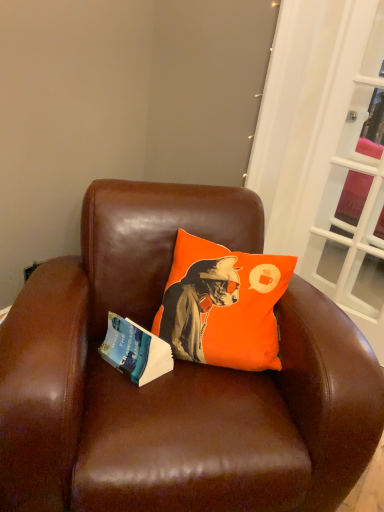
This screenshot has height=512, width=384. What do you see at coordinates (135, 351) in the screenshot?
I see `blue paper book at left` at bounding box center [135, 351].

Measure the distance between blue paper book at left and camera.

The distance of blue paper book at left from camera is 1.15 meters.

The image size is (384, 512). What do you see at coordinates (350, 181) in the screenshot? I see `white glass screen door at right` at bounding box center [350, 181].

I want to click on brown leather chair at center, so click(x=175, y=379).

Measure the distance between orange fabric pillow at center and camera.

orange fabric pillow at center is 1.21 meters away from camera.

What do you see at coordinates (223, 305) in the screenshot?
I see `orange fabric pillow at center` at bounding box center [223, 305].

The height and width of the screenshot is (512, 384). What are the coordinates of `blue paper book at left` in the screenshot? It's located at pos(135,351).

Is white glass screen door at right at the back of brown leather chair at center?

No, brown leather chair at center is not facing the opposite direction of white glass screen door at right.

Based on the photo, how different are the orientations of brown leather chair at center and white glass screen door at right in degrees?

They differ by 44.5 degrees in their facing directions.

The height and width of the screenshot is (512, 384). In order to click on screen door behind the brown leather chair at center in this screenshot , I will do `click(350, 181)`.

Are brown leather chair at center and white glass screen door at right located far from each other?

That's not correct — brown leather chair at center is a little close to white glass screen door at right.

Is the depth of white glass screen door at right greater than that of orange fabric pillow at center?

Yes, the depth of white glass screen door at right is greater than that of orange fabric pillow at center.

Would you say white glass screen door at right is a long distance from orange fabric pillow at center?

No.

From a real-world perspective, which is physically below, blue paper book at left or brown leather chair at center?

From a 3D spatial view, brown leather chair at center is below.

Considering the relative sizes of blue paper book at left and brown leather chair at center in the image provided, is blue paper book at left wider than brown leather chair at center?

No, blue paper book at left is not wider than brown leather chair at center.

From the image's perspective, which object appears higher, blue paper book at left or brown leather chair at center?

blue paper book at left appears higher in the image.

Consider the image. In the image, is blue paper book at left positioned in front of or behind brown leather chair at center?

Visually, blue paper book at left is located behind brown leather chair at center.

How much distance is there between white glass screen door at right and brown leather chair at center?

white glass screen door at right is 37.99 inches from brown leather chair at center.

Based on the photo, which of these two, white glass screen door at right or brown leather chair at center, is wider?

With larger width is brown leather chair at center.

Is the position of white glass screen door at right more distant than that of brown leather chair at center?

Yes, white glass screen door at right is further from the camera.

From the image's perspective, between white glass screen door at right and brown leather chair at center, who is located below?

brown leather chair at center, from the image's perspective.

Could you tell me if blue paper book at left is facing orange fabric pillow at center?

No.

Considering the relative sizes of blue paper book at left and orange fabric pillow at center in the image provided, is blue paper book at left thinner than orange fabric pillow at center?

Yes, blue paper book at left is thinner than orange fabric pillow at center.

Is blue paper book at left not inside orange fabric pillow at center?

That's correct, blue paper book at left is outside of orange fabric pillow at center.

From the image's perspective, is blue paper book at left located above or below orange fabric pillow at center?

From the image's perspective, blue paper book at left appears below orange fabric pillow at center.

Considering the sizes of objects orange fabric pillow at center and brown leather chair at center in the image provided, who is taller, orange fabric pillow at center or brown leather chair at center?

With more height is brown leather chair at center.

Could you tell me if orange fabric pillow at center is facing brown leather chair at center?

A: Yes, orange fabric pillow at center is oriented towards brown leather chair at center.

From a real-world perspective, relative to brown leather chair at center, is orange fabric pillow at center vertically above or below?

orange fabric pillow at center is situated higher than brown leather chair at center in the real world.

Which is more to the left, white glass screen door at right or blue paper book at left?

blue paper book at left is more to the left.

Is white glass screen door at right facing away from blue paper book at left?

No, white glass screen door at right is not facing away from blue paper book at left.

Find the location of `screen door behind the blue paper book at left`. screen door behind the blue paper book at left is located at coordinates pos(350,181).

Can you tell me how much white glass screen door at right and blue paper book at left differ in facing direction?

The angle between the facing direction of white glass screen door at right and the facing direction of blue paper book at left is 76.6 degrees.

At what (x,y) coordinates should I click in order to perform the action: click on chair that appears below the white glass screen door at right (from the image's perspective). Please return your answer as a coordinate pair (x, y). The height and width of the screenshot is (512, 384). Looking at the image, I should click on (175, 379).

This screenshot has width=384, height=512. Identify the location of screen door that is above the orange fabric pillow at center (from a real-world perspective). (350, 181).

Considering their positions, is blue paper book at left positioned further to brown leather chair at center than white glass screen door at right?

white glass screen door at right is further to brown leather chair at center.

Which object lies further to the anchor point white glass screen door at right, brown leather chair at center or orange fabric pillow at center?

brown leather chair at center lies further to white glass screen door at right than the other object.

When comparing their distances from white glass screen door at right, does orange fabric pillow at center or brown leather chair at center seem further?

brown leather chair at center.

From the image, which object appears to be farther from orange fabric pillow at center, white glass screen door at right or brown leather chair at center?

white glass screen door at right is positioned further to the anchor orange fabric pillow at center.

Estimate the real-world distances between objects in this image. Which object is further from blue paper book at left, brown leather chair at center or orange fabric pillow at center?

brown leather chair at center is positioned further to the anchor blue paper book at left.

Based on their spatial positions, is white glass screen door at right or blue paper book at left closer to brown leather chair at center?

Among the two, blue paper book at left is located nearer to brown leather chair at center.

Based on the photo, considering their positions, is orange fabric pillow at center positioned closer to brown leather chair at center than white glass screen door at right?

orange fabric pillow at center is closer to brown leather chair at center.

When comparing their distances from brown leather chair at center, does white glass screen door at right or orange fabric pillow at center seem further?

white glass screen door at right.

Where is `pillow between blue paper book at left and white glass screen door at right from left to right`? This screenshot has width=384, height=512. pillow between blue paper book at left and white glass screen door at right from left to right is located at coordinates (223, 305).

Locate an element on the screen. This screenshot has width=384, height=512. pillow between brown leather chair at center and blue paper book at left from front to back is located at coordinates (223, 305).

Identify the location of pillow between brown leather chair at center and white glass screen door at right from left to right. click(223, 305).

Where is `chair situated between blue paper book at left and white glass screen door at right from left to right`? The height and width of the screenshot is (512, 384). chair situated between blue paper book at left and white glass screen door at right from left to right is located at coordinates (175, 379).